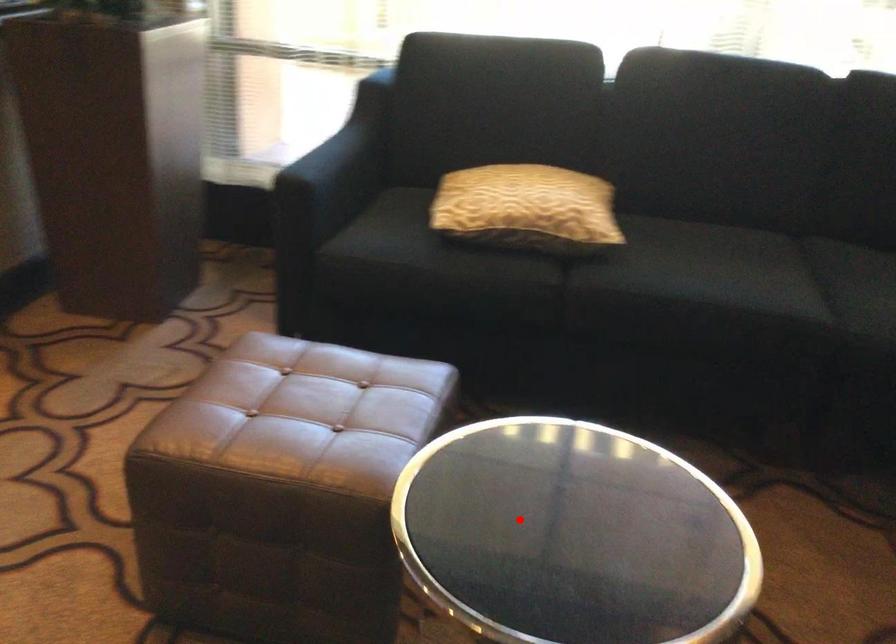
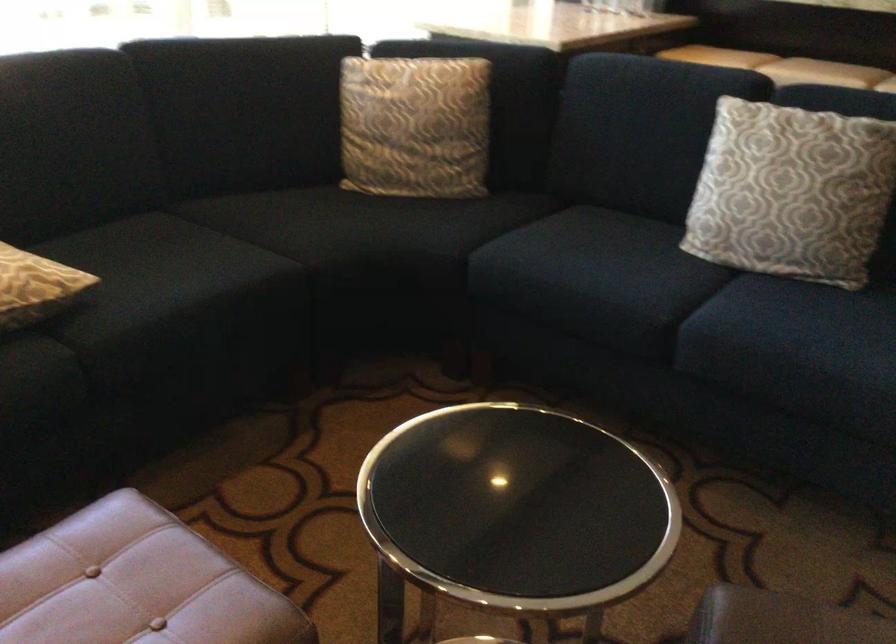
Where in the second image is the point corresponding to the highlighted location from the first image?

(517, 507)